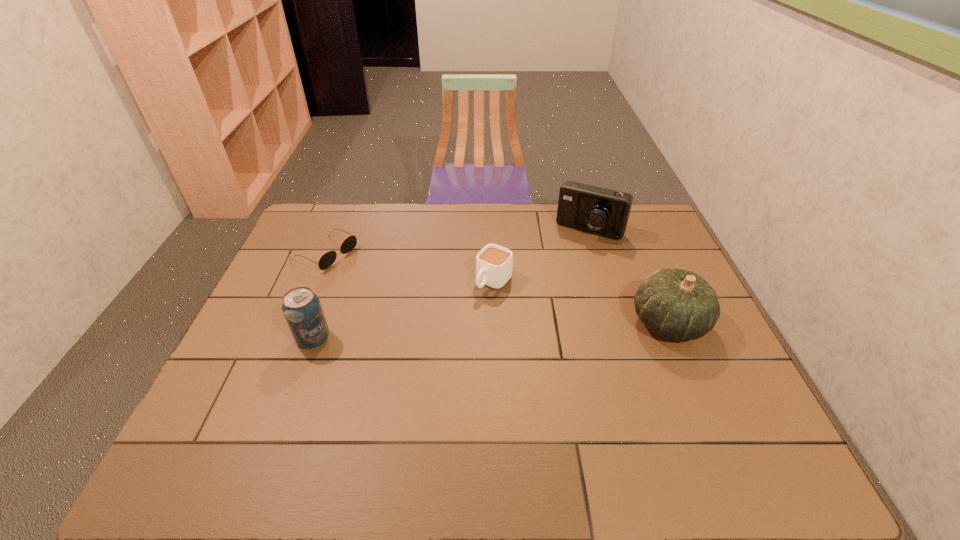
Image resolution: width=960 pixels, height=540 pixels. In the image, there is a desktop. In order to click on vacant space at the near right corner in this screenshot , I will do `click(741, 419)`.

At what (x,y) coordinates should I click in order to perform the action: click on free space between the camera and the sunglasses. Please return your answer as a coordinate pair (x, y). The height and width of the screenshot is (540, 960). Looking at the image, I should click on point(457,241).

Find the location of a particular element. The image size is (960, 540). free point between the second shortest object and the shortest object is located at coordinates (410, 267).

At what (x,y) coordinates should I click in order to perform the action: click on vacant space in between the camera and the third object from left to right. Please return your answer as a coordinate pair (x, y). This screenshot has height=540, width=960. Looking at the image, I should click on (541, 255).

Find the location of a particular element. free space between the sunglasses and the camera is located at coordinates (457, 241).

Where is `empty location between the third object from left to right and the gourd`? The height and width of the screenshot is (540, 960). empty location between the third object from left to right and the gourd is located at coordinates (581, 302).

The width and height of the screenshot is (960, 540). I want to click on free space between the shortest object and the camera, so click(457, 241).

You are a GUI agent. You are given a task and a screenshot of the screen. Output one action in this format:
    pyautogui.click(x=<x>, y=<y>)
    Task: Click on the free area in between the third object from right to left and the camera
    The width and height of the screenshot is (960, 540).
    Given the screenshot: What is the action you would take?
    pyautogui.click(x=541, y=255)

Find the location of a particular element. Image resolution: width=960 pixels, height=540 pixels. vacant region between the gourd and the pop soda is located at coordinates (491, 330).

Select which object is the fourth closest to the shortest object. Please provide its 2D coordinates. Your answer should be formatted as a tuple, i.e. [(x, y)], where the tuple contains the x and y coordinates of a point satisfying the conditions above.

[(677, 304)]